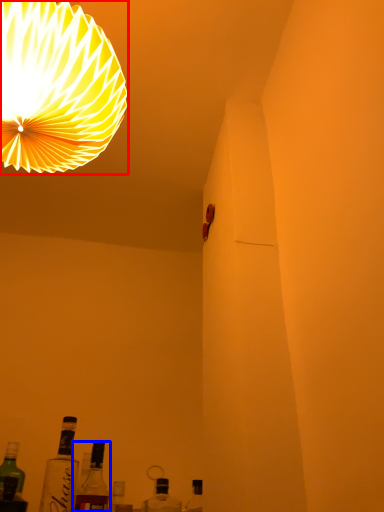
Question: Which object appears closest to the camera in this image, lamp (highlighted by a red box) or bottle (highlighted by a blue box)?

Choices:
 (A) lamp
 (B) bottle

Answer: (A)